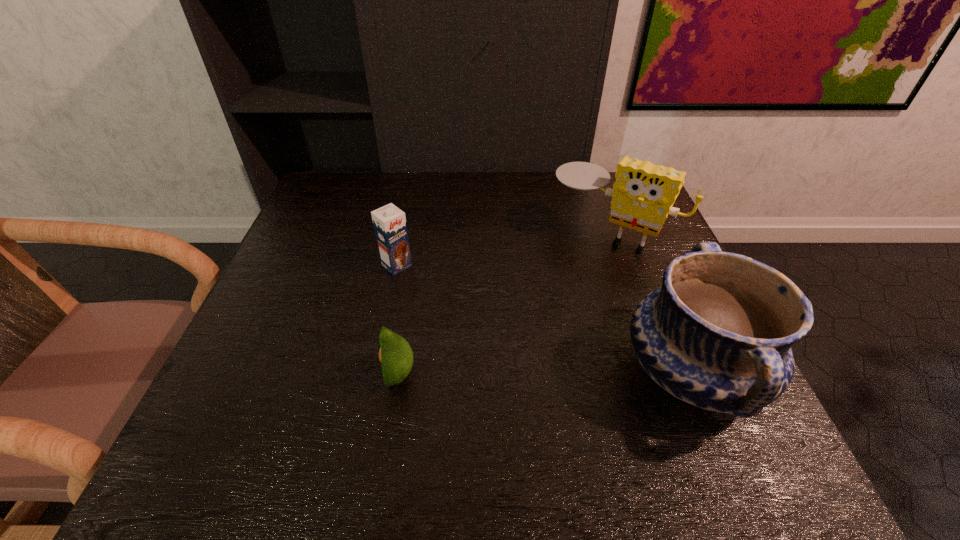
This screenshot has width=960, height=540. Identify the location of free location located on the front-facing side of the sponge. (544, 312).

Find the location of a particular element. The image size is (960, 540). vacant space located on the front label of the chocolate milk is located at coordinates (521, 374).

Locate an element on the screen. This screenshot has height=540, width=960. free location located on the front label of the chocolate milk is located at coordinates 495,352.

Find the location of a particular element. The image size is (960, 540). free space located 0.320m on the front label of the chocolate milk is located at coordinates [502, 358].

You are a GUI agent. You are given a task and a screenshot of the screen. Output one action in this format:
    pyautogui.click(x=<x>, y=<y>)
    Task: Click on the object present at the far edge
    Image resolution: width=960 pixels, height=540 pixels.
    Given the screenshot: What is the action you would take?
    pyautogui.click(x=643, y=194)

The image size is (960, 540). Identify the location of avocado that is at the near edge. (395, 354).

Locate an element on the screen. Image resolution: width=960 pixels, height=540 pixels. pottery that is positioned at the near edge is located at coordinates (718, 334).

Identify the location of pottery that is at the right edge. The height and width of the screenshot is (540, 960). (718, 334).

Locate an element on the screen. sponge that is at the right edge is located at coordinates (643, 194).

You are a GUI agent. You are given a task and a screenshot of the screen. Output one action in this format:
    pyautogui.click(x=<x>, y=<y>)
    Task: Click on the object situated at the far right corner
    
    Given the screenshot: What is the action you would take?
    pyautogui.click(x=643, y=194)